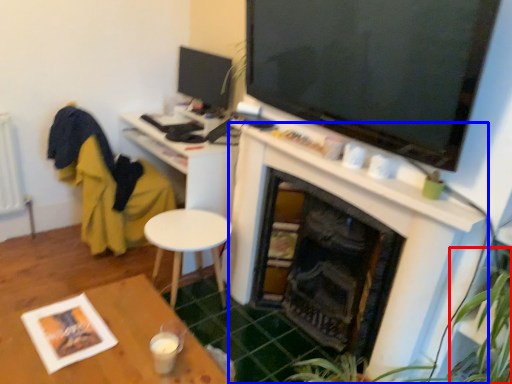
Question: Which of the following is the closest to the observer, plant (highlighted by a red box) or fireplace (highlighted by a blue box)?

Choices:
 (A) plant
 (B) fireplace

Answer: (A)